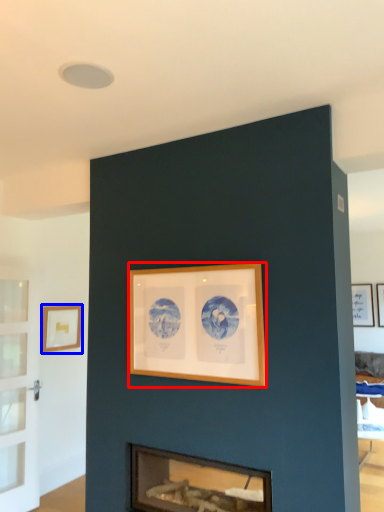
Question: Among these objects, which one is nearest to the camera, picture frame (highlighted by a red box) or picture frame (highlighted by a blue box)?

Choices:
 (A) picture frame
 (B) picture frame

Answer: (A)